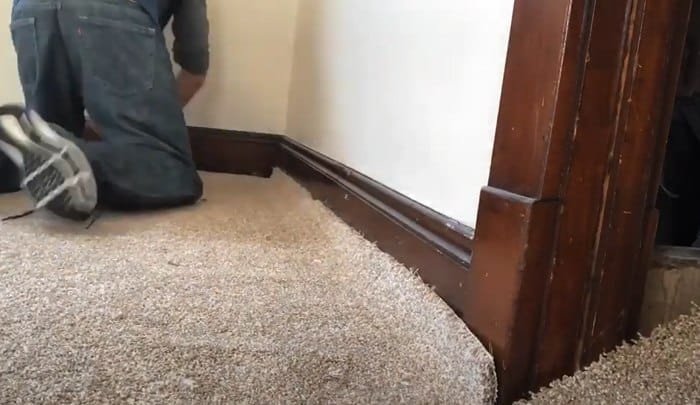
Where is `door`? The width and height of the screenshot is (700, 405). door is located at coordinates (682, 186).